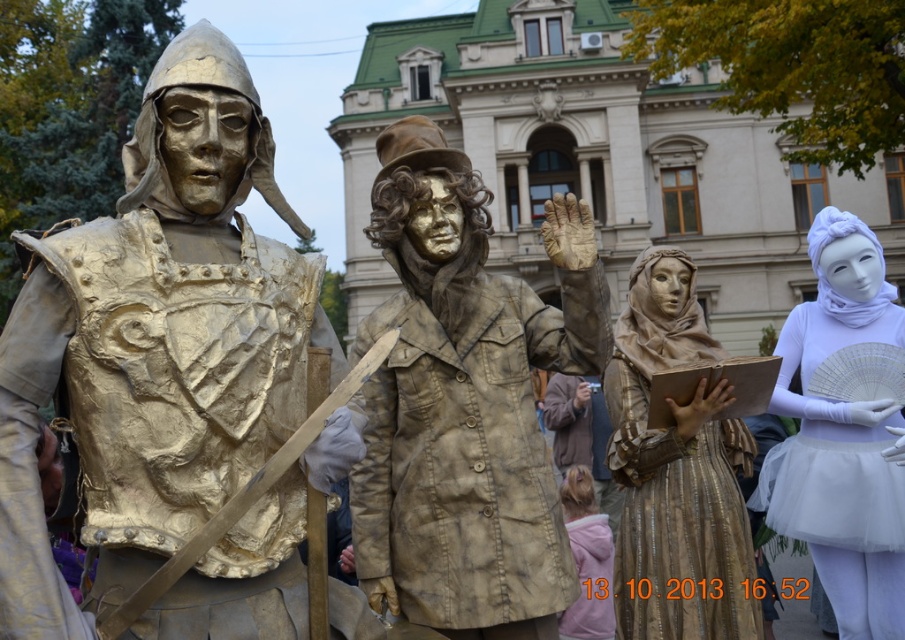
Can you confirm if gold textured coat at center is smaller than white tulle skirt at right?

Correct, gold textured coat at center occupies less space than white tulle skirt at right.

Does gold textured coat at center have a lesser height compared to white tulle skirt at right?

Correct, gold textured coat at center is not as tall as white tulle skirt at right.

Is point (535, 540) more distant than point (826, 566)?

No.

Identify the location of gold textured coat at center. The image size is (905, 640). (465, 403).

Does gold textured fabric dress at center have a larger size compared to white tulle skirt at right?

Incorrect, gold textured fabric dress at center is not larger than white tulle skirt at right.

How distant is gold textured fabric dress at center from white tulle skirt at right?

They are 3.96 meters apart.

Between point (662, 280) and point (878, 442), which one is positioned in front?

Point (878, 442) is in front.

This screenshot has width=905, height=640. What are the coordinates of `gold textured fabric dress at center` in the screenshot? It's located at (675, 472).

Measure the distance between bronze armor at left and camera.

A distance of 17.83 meters exists between bronze armor at left and camera.

Between point (88, 508) and point (879, 400), which one is positioned behind?

Positioned behind is point (879, 400).

The image size is (905, 640). Find the location of `bronze armor at left`. bronze armor at left is located at coordinates (156, 342).